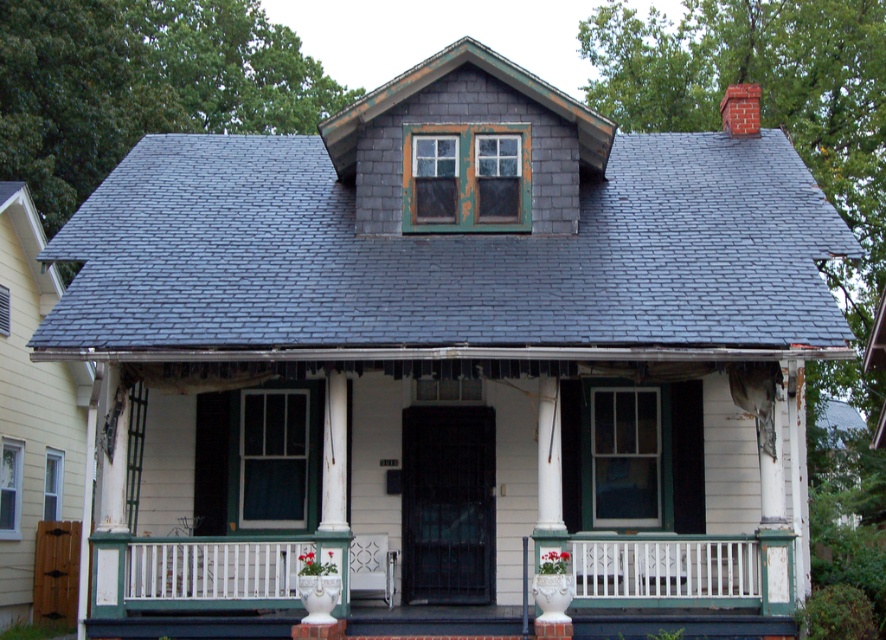
You are a painter assessing the house for a new coat of paint. You need to estimate the surface area to be painted. Which object requires more paint between the white painted wood porch at center and the white glossy column at center?

The white painted wood porch at center requires more paint because it is larger in size than the white glossy column at center.

You are standing on the lawn in front of the house and want to place a small potted plant on the white painted wood porch at center. However, you notice a decorative statue that is exactly 1.2 meters tall. Can the statue fit on the porch without exceeding its height? Please consider the height of the white glossy column at center as a reference.

The white painted wood porch at center is shorter than the white glossy column at center. Since the statue is 1.2 meters tall, and the porch is shorter than the column, we need to compare the statue height with the porch height. However, without knowing the exact height of the column or the porch, we cannot definitively determine if the statue will fit. Additional measurements are required.

You are standing on the front lawn of the house and looking up at the white painted wood porch at center and the white glossy column at center. Which object is positioned higher from the ground?

The white glossy column at center is higher from the ground than the white painted wood porch at center because the porch is below the column.